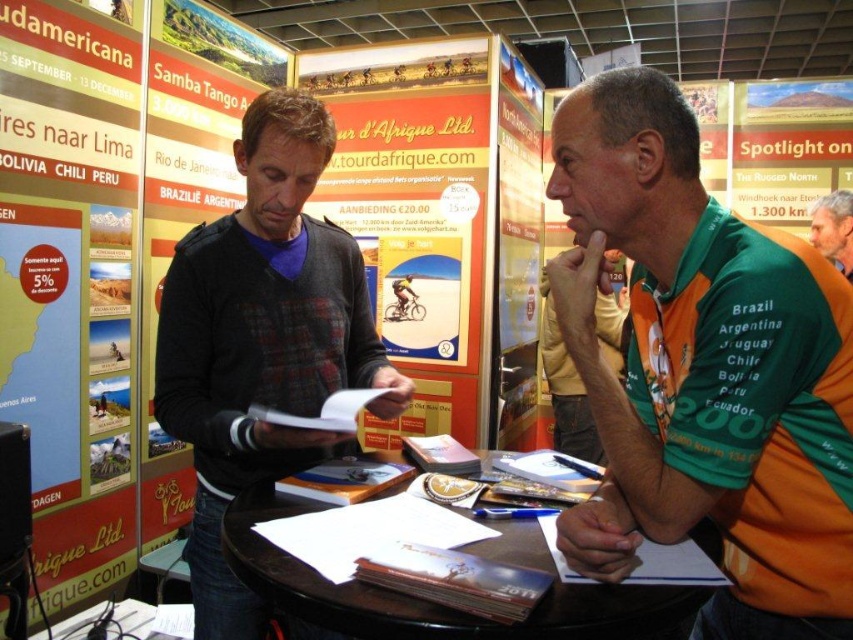
Does dark gray sweater at center have a lesser width compared to green jersey at upper right?

Incorrect, dark gray sweater at center's width is not less than green jersey at upper right's.

Which is more to the right, dark gray sweater at center or green jersey at upper right?

From the viewer's perspective, green jersey at upper right appears more on the right side.

Find the location of a particular element. dark gray sweater at center is located at coordinates (262, 340).

Does dark gray sweater at center have a lesser height compared to green jersey at right?

In fact, dark gray sweater at center may be taller than green jersey at right.

Is dark gray sweater at center wider than green jersey at right?

Indeed, dark gray sweater at center has a greater width compared to green jersey at right.

Is point (173, 272) less distant than point (622, 326)?

Yes, point (173, 272) is closer to viewer.

Locate an element on the screen. The image size is (853, 640). dark gray sweater at center is located at coordinates (262, 340).

Does point (579, 205) come in front of point (552, 403)?

Yes.

Between green jersey at center and green jersey at right, which one appears on the left side from the viewer's perspective?

green jersey at center

Which is in front, point (753, 470) or point (605, 358)?

Point (753, 470) is in front.

Where is `green jersey at center`? green jersey at center is located at coordinates (704, 371).